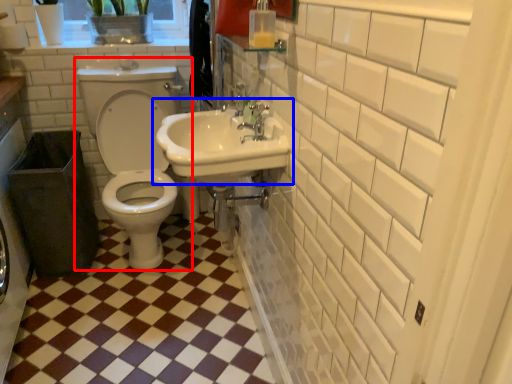
Question: Which object appears farthest to the camera in this image, toilet (highlighted by a red box) or sink (highlighted by a blue box)?

Choices:
 (A) toilet
 (B) sink

Answer: (A)